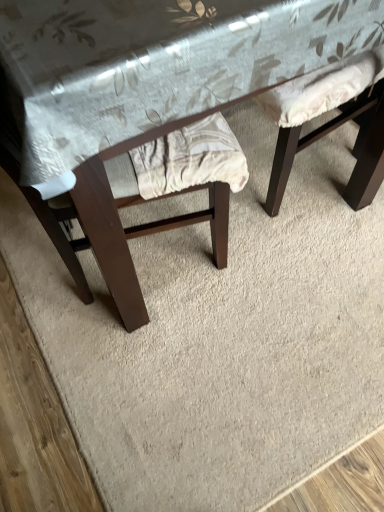
Measure the distance between wooden table at center and camera.

20.86 inches.

What is the approximate width of wooden table at center?

It is 37.71 inches.

The image size is (384, 512). What do you see at coordinates (154, 94) in the screenshot?
I see `wooden table at center` at bounding box center [154, 94].

You are a GUI agent. You are given a task and a screenshot of the screen. Output one action in this format:
    pyautogui.click(x=<x>, y=<y>)
    Task: Click on the wooden table at center
    This screenshot has width=384, height=512.
    Given the screenshot: What is the action you would take?
    pyautogui.click(x=154, y=94)

Image resolution: width=384 pixels, height=512 pixels. Find the location of `matte fabric swivel chair at upper right`. matte fabric swivel chair at upper right is located at coordinates (327, 123).

Measure the distance between matte fabric swivel chair at upper right and camera.

matte fabric swivel chair at upper right is 36.34 inches from camera.

Describe the element at coordinates (327, 123) in the screenshot. This screenshot has height=512, width=384. I see `matte fabric swivel chair at upper right` at that location.

The image size is (384, 512). Find the location of `wooden table at center`. wooden table at center is located at coordinates (154, 94).

Considering the positions of objects wooden table at center and matte fabric swivel chair at upper right in the image provided, who is more to the left, wooden table at center or matte fabric swivel chair at upper right?

From the viewer's perspective, wooden table at center appears more on the left side.

Based on the photo, is the position of wooden table at center less distant than that of matte fabric swivel chair at upper right?

Yes.

Considering the positions of points (115, 278) and (377, 73), is point (115, 278) closer to camera compared to point (377, 73)?

Yes.

From the image's perspective, which one is positioned higher, wooden table at center or matte fabric swivel chair at upper right?

wooden table at center appears higher in the image.

From a real-world perspective, is wooden table at center positioned above or below matte fabric swivel chair at upper right?

Clearly, from a real-world perspective, wooden table at center is above matte fabric swivel chair at upper right.

Does wooden table at center have a greater width compared to matte fabric swivel chair at upper right?

Indeed, wooden table at center has a greater width compared to matte fabric swivel chair at upper right.

From their relative heights in the image, would you say wooden table at center is taller or shorter than matte fabric swivel chair at upper right?

Clearly, wooden table at center is taller compared to matte fabric swivel chair at upper right.

Which of these two, wooden table at center or matte fabric swivel chair at upper right, is bigger?

wooden table at center is bigger.

Do you think wooden table at center is within matte fabric swivel chair at upper right, or outside of it?

wooden table at center is not inside matte fabric swivel chair at upper right, it's outside.

Is wooden table at center beside matte fabric swivel chair at upper right?

No, wooden table at center is not with matte fabric swivel chair at upper right.

Is wooden table at center positioned with its back to matte fabric swivel chair at upper right?

Absolutely, wooden table at center is directed away from matte fabric swivel chair at upper right.

Identify the location of swivel chair that is on the right side of wooden table at center. Image resolution: width=384 pixels, height=512 pixels. (327, 123).

Is matte fabric swivel chair at upper right to the right of wooden table at center from the viewer's perspective?

Indeed, matte fabric swivel chair at upper right is positioned on the right side of wooden table at center.

Is matte fabric swivel chair at upper right in front of or behind wooden table at center in the image?

In the image, matte fabric swivel chair at upper right appears behind wooden table at center.

Is point (266, 111) less distant than point (95, 120)?

No, (266, 111) is further to viewer.

From the image's perspective, relative to wooden table at center, is matte fabric swivel chair at upper right above or below?

matte fabric swivel chair at upper right is situated lower than wooden table at center in the image.

From a real-world perspective, who is located lower, matte fabric swivel chair at upper right or wooden table at center?

In real-world perspective, matte fabric swivel chair at upper right is lower.

Which object is wider, matte fabric swivel chair at upper right or wooden table at center?

Wider between the two is wooden table at center.

Is matte fabric swivel chair at upper right shorter than wooden table at center?

Correct, matte fabric swivel chair at upper right is not as tall as wooden table at center.

Looking at the image, does matte fabric swivel chair at upper right seem bigger or smaller compared to wooden table at center?

Considering their sizes, matte fabric swivel chair at upper right takes up less space than wooden table at center.

Choose the correct answer: Is matte fabric swivel chair at upper right inside wooden table at center or outside it?

matte fabric swivel chair at upper right can be found inside wooden table at center.

Is the surface of matte fabric swivel chair at upper right in direct contact with wooden table at center?

matte fabric swivel chair at upper right and wooden table at center are not in contact.

Could you tell me if matte fabric swivel chair at upper right is facing wooden table at center?

Yes, matte fabric swivel chair at upper right faces towards wooden table at center.

The image size is (384, 512). I want to click on table that is on the left side of matte fabric swivel chair at upper right, so click(x=154, y=94).

In order to click on swivel chair below the wooden table at center (from a real-world perspective) in this screenshot , I will do click(327, 123).

What are the coordinates of `table in front of the matte fabric swivel chair at upper right` in the screenshot? It's located at (154, 94).